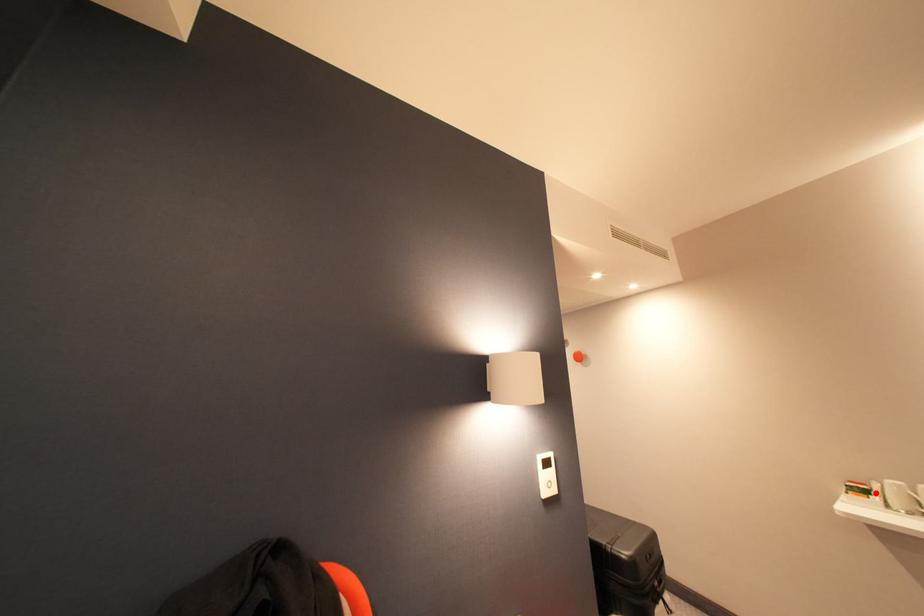
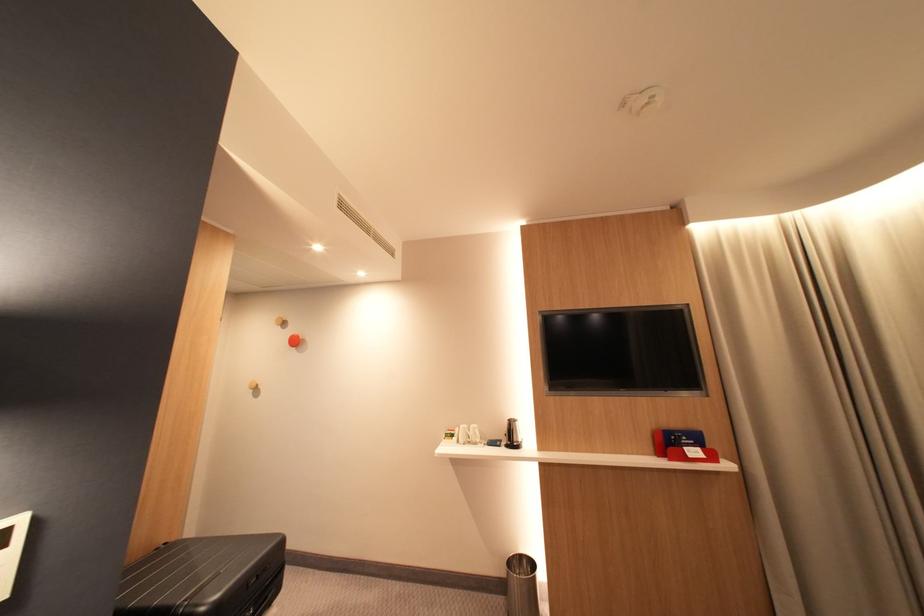
Locate, in the second image, the point that corresponds to the highlighted location in the first image.

(463, 437)